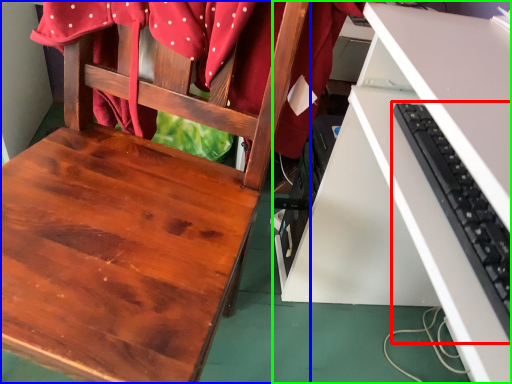
Question: Considering the real-world distances, which object is closest to computer keyboard (highlighted by a red box)? chair (highlighted by a blue box) or desk (highlighted by a green box).

Choices:
 (A) chair
 (B) desk

Answer: (B)